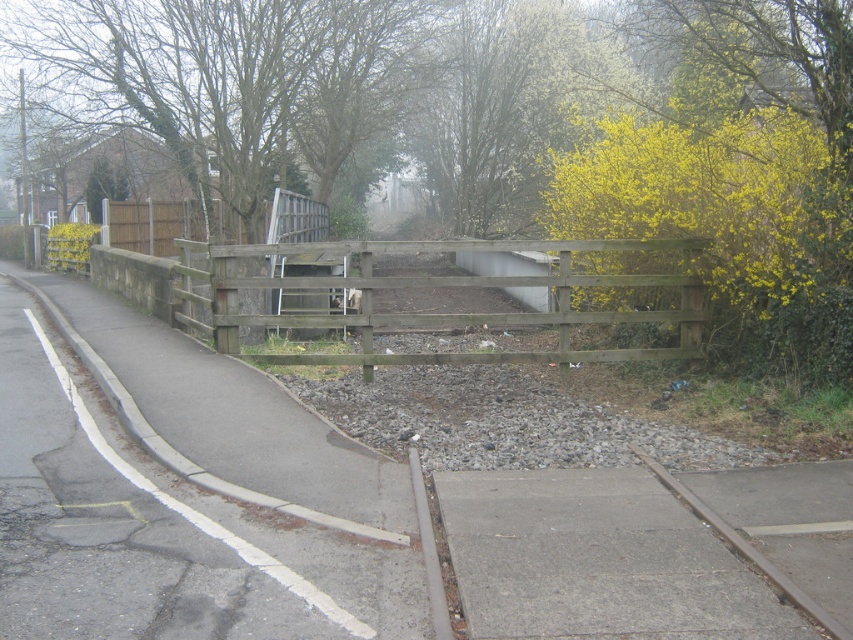
Question: Which of the following is the closest to the observer?

Choices:
 (A) gray concrete pavement at center
 (B) brown wooden train track at lower right

Answer: (B)

Question: Does smooth concrete pavement at center have a lesser width compared to gray concrete pavement at center?

Choices:
 (A) no
 (B) yes

Answer: (A)

Question: Among these points, which one is nearest to the camera?

Choices:
 (A) (206, 301)
 (B) (596, 513)
 (C) (94, 305)
 (D) (633, 452)

Answer: (B)

Question: In this image, where is gray concrete pavement at center located relative to brown wooden fence at center?

Choices:
 (A) left
 (B) right

Answer: (B)

Question: Is brown wooden fence at center below brown wooden train track at lower right?

Choices:
 (A) yes
 (B) no

Answer: (B)

Question: Which of the following is the closest to the observer?

Choices:
 (A) 672,570
 (B) 746,560
 (C) 192,406
 (D) 343,285

Answer: (A)